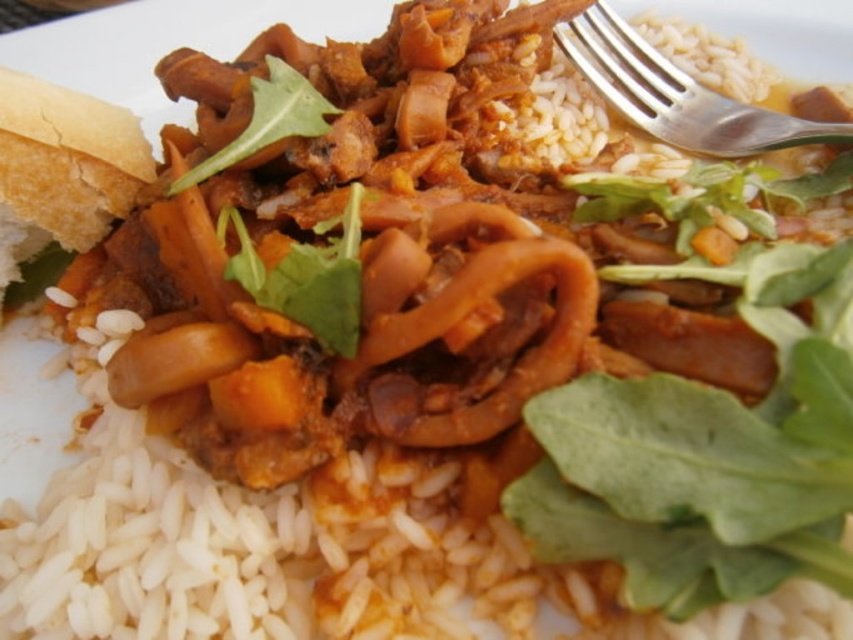
You are a chef arranging a dish and want to place a new garnish between the white bread at left and the green leafy vegetable at center. If the garnish requires 16 inches of space, will there be enough room between them?

The distance between the white bread at left and the green leafy vegetable at center is 15.91 inches. Since the required space for the garnish is 16 inches, there is not enough room between them.

You are a diner who wants to pick up the green leafy vegetable at center with the silver metallic fork at upper right. Can you reach the vegetable with the fork?

The silver metallic fork at upper right is located above the green leafy vegetable at center, so yes, you can reach the vegetable with the fork by moving it downward from its current position.

You are a food critic inspecting this dish. You need to determine if the silver metallic fork at upper right can be placed upright on the plate without touching the green leafy at center. Based on their heights, can it be done?

The silver metallic fork at upper right is much taller than the green leafy at center. Since the fork is taller, placing it upright on the plate would likely cause it to lean or touch the green leafy at center unless positioned carefully away from it.